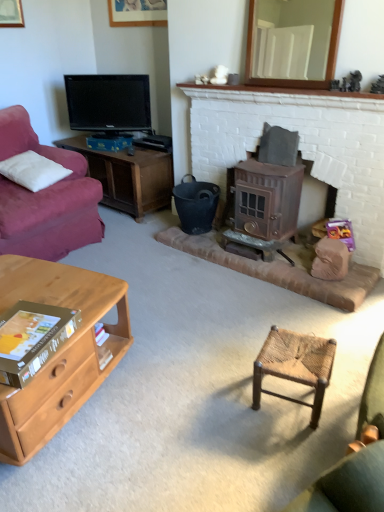
You are a GUI agent. You are given a task and a screenshot of the screen. Output one action in this format:
    pyautogui.click(x=<x>, y=<y>)
    Task: Click on the bronze metallic wood burning stove at center-right
    Image resolution: width=384 pixels, height=512 pixels.
    Given the screenshot: What is the action you would take?
    click(262, 205)

Find the location of `gold cardboard book at lower left`. gold cardboard book at lower left is located at coordinates (32, 339).

What are the coordinates of `light brown wood desk at lower left` in the screenshot? It's located at (58, 350).

Locate an element on the screen. This screenshot has width=384, height=512. white soft pillow at upper left is located at coordinates click(x=33, y=170).

This screenshot has height=512, width=384. What are the coordinates of `woven wood stool at center` in the screenshot? It's located at (295, 365).

The width and height of the screenshot is (384, 512). Find the location of `white brick fireplace at upper center`. white brick fireplace at upper center is located at coordinates (281, 90).

From a real-world perspective, is light brown wood desk at lower left located higher than bronze metallic stove at center?

No, from a real-world perspective, light brown wood desk at lower left is not above bronze metallic stove at center.

Is light brown wood desk at lower left aimed at bronze metallic stove at center?

No.

Do you think light brown wood desk at lower left is within bronze metallic stove at center, or outside of it?

light brown wood desk at lower left cannot be found inside bronze metallic stove at center.

Does light brown wood desk at lower left have a greater width compared to bronze metallic stove at center?

Yes.

Does woven wood stool at center have a lesser width compared to bronze metallic stove at center?

In fact, woven wood stool at center might be wider than bronze metallic stove at center.

Is woven wood stool at center taller or shorter than bronze metallic stove at center?

In the image, woven wood stool at center appears to be shorter than bronze metallic stove at center.

From a real-world perspective, is woven wood stool at center on bronze metallic stove at center?

No, from a real-world perspective, woven wood stool at center is not over bronze metallic stove at center

Does woven wood stool at center have a smaller size compared to bronze metallic stove at center?

Indeed, woven wood stool at center has a smaller size compared to bronze metallic stove at center.

Between bronze metallic wood burning stove at center-right and bronze metallic stove at center, which one has more height?

bronze metallic stove at center.

From the image's perspective, would you say bronze metallic wood burning stove at center-right is shown under bronze metallic stove at center?

Yes, from the image's perspective, bronze metallic wood burning stove at center-right is below bronze metallic stove at center.

Is bronze metallic stove at center inside bronze metallic wood burning stove at center-right?

Definitely not — bronze metallic stove at center is not inside bronze metallic wood burning stove at center-right.

From a real-world perspective, is wooden picture frame at upper center physically located above or below black matte bucket at center?

In terms of real-world spatial position, wooden picture frame at upper center is above black matte bucket at center.

The width and height of the screenshot is (384, 512). I want to click on picture frame on the left side of black matte bucket at center, so click(x=137, y=13).

Can you confirm if wooden picture frame at upper center is thinner than black matte bucket at center?

Correct, the width of wooden picture frame at upper center is less than that of black matte bucket at center.

Is wooden picture frame at upper center at the left side of black matte bucket at center?

Yes, wooden picture frame at upper center is to the left of black matte bucket at center.

From the image's perspective, is white wooden mirror at upper center over black matte bucket at center?

Yes, from the image's perspective, white wooden mirror at upper center is on top of black matte bucket at center.

Can you tell me how much white wooden mirror at upper center and black matte bucket at center differ in facing direction?

There is a 0.962-degree angle between the facing directions of white wooden mirror at upper center and black matte bucket at center.

From a real-world perspective, is white wooden mirror at upper center above or below black matte bucket at center?

From a real-world perspective, white wooden mirror at upper center is physically above black matte bucket at center.

Is black matte bucket at center located within white wooden mirror at upper center?

No.

Which is more distant, (323, 359) or (204, 87)?

The point (204, 87) is farther.

Which object is more forward, woven wood stool at center or white brick fireplace at upper center?

woven wood stool at center is closer to the camera.

In terms of size, does woven wood stool at center appear bigger or smaller than white brick fireplace at upper center?

Considering their sizes, woven wood stool at center takes up more space than white brick fireplace at upper center.

From a real-world perspective, is black matte bucket at center physically above blue cardboard box at left?

No, from a real-world perspective, black matte bucket at center is not above blue cardboard box at left.

The height and width of the screenshot is (512, 384). In order to click on box on the left of the black matte bucket at center in this screenshot , I will do `click(109, 142)`.

Is blue cardboard box at left located within black matte bucket at center?

No, blue cardboard box at left is located outside of black matte bucket at center.

Which of these two, black matte bucket at center or blue cardboard box at left, stands shorter?

Standing shorter between the two is blue cardboard box at left.

At what (x,y) coordinates should I click in order to perform the action: click on desk beneath the bronze metallic stove at center (from a real-world perspective). Please return your answer as a coordinate pair (x, y). Looking at the image, I should click on (58, 350).

There is a woven wood stool at center. Where is `fireplace above it (from a real-world perspective)`? This screenshot has width=384, height=512. fireplace above it (from a real-world perspective) is located at coordinates (301, 146).

From the picture: When comparing their distances from white soft pillow at upper left, does bronze metallic wood burning stove at center-right or black glossy tv at upper left seem further?

Based on the image, bronze metallic wood burning stove at center-right appears to be further to white soft pillow at upper left.

Based on their spatial positions, is bronze metallic wood burning stove at center-right or black matte bucket at center further from wooden picture frame at upper center?

bronze metallic wood burning stove at center-right is positioned further to the anchor wooden picture frame at upper center.

Based on their spatial positions, is bronze metallic wood burning stove at center-right or blue cardboard box at left further from gold cardboard book at lower left?

blue cardboard box at left.

Based on their spatial positions, is wooden picture frame at upper center or white brick fireplace at upper center further from gold cardboard book at lower left?

The object further to gold cardboard book at lower left is wooden picture frame at upper center.

Which object lies further to the anchor point light brown wood desk at lower left, bronze metallic wood burning stove at center-right or white soft pillow at upper left?

Among the two, bronze metallic wood burning stove at center-right is located further to light brown wood desk at lower left.

From the picture: Considering their positions, is light brown wood desk at lower left positioned closer to gold cardboard book at lower left than black matte bucket at center?

light brown wood desk at lower left lies closer to gold cardboard book at lower left than the other object.

Considering their positions, is black glossy tv at upper left positioned further to black matte bucket at center than bronze metallic wood burning stove at center-right?

The object further to black matte bucket at center is black glossy tv at upper left.

Based on their spatial positions, is white wooden mirror at upper center or white brick fireplace at upper center closer to woven wood stool at center?

The object closer to woven wood stool at center is white brick fireplace at upper center.

At what (x,y) coordinates should I click in order to perform the action: click on mantle between light brown wood desk at lower left and black glossy tv at upper left in the front-back direction. Please return your answer as a coordinate pair (x, y). The width and height of the screenshot is (384, 512). Looking at the image, I should click on (281, 90).

Image resolution: width=384 pixels, height=512 pixels. Identify the location of stool located between gold cardboard book at lower left and black matte bucket at center in the depth direction. (295, 365).

Find the location of a particular element. television between wooden picture frame at upper center and bronze metallic stove at center in the vertical direction is located at coordinates 108,103.

Locate an element on the screen. The image size is (384, 512). television between wooden picture frame at upper center and bronze metallic wood burning stove at center-right in the up-down direction is located at coordinates (108, 103).